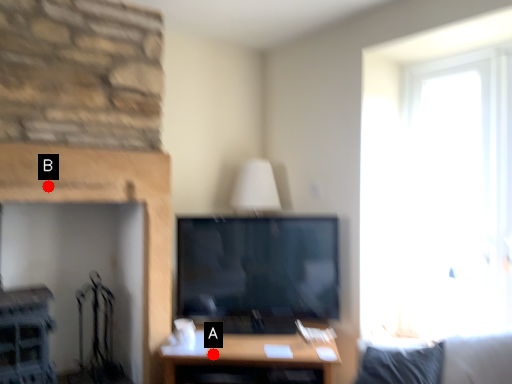
Question: Two points are circled on the image, labeled by A and B beside each circle. Which point appears closest to the camera in this image?

Choices:
 (A) A is closer
 (B) B is closer

Answer: (B)